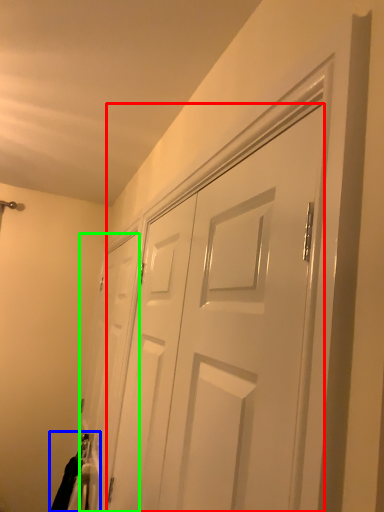
Question: Estimate the real-world distances between objects in this image. Which object is farther from door (highlighted by a red box), laundry (highlighted by a blue box) or door (highlighted by a green box)?

Choices:
 (A) laundry
 (B) door

Answer: (A)